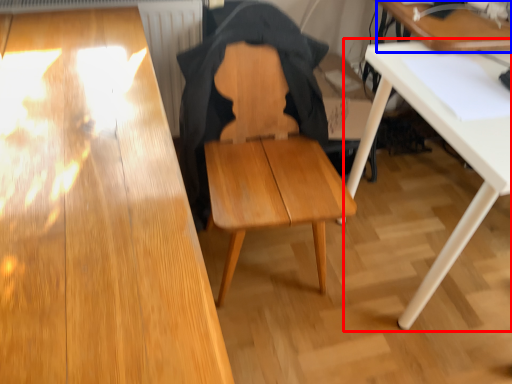
Question: Which point is further to the camera, table (highlighted by a red box) or table (highlighted by a blue box)?

Choices:
 (A) table
 (B) table

Answer: (B)